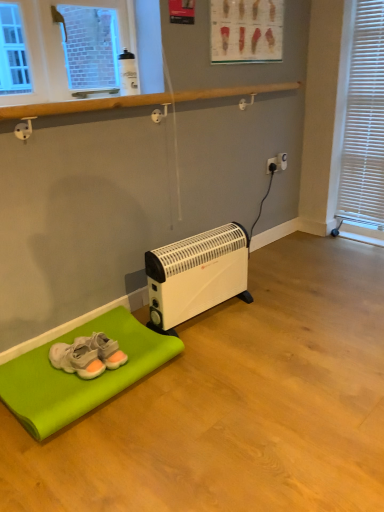
Identify the location of unoccupied region to the right of white plastic heater at lower center. (284, 321).